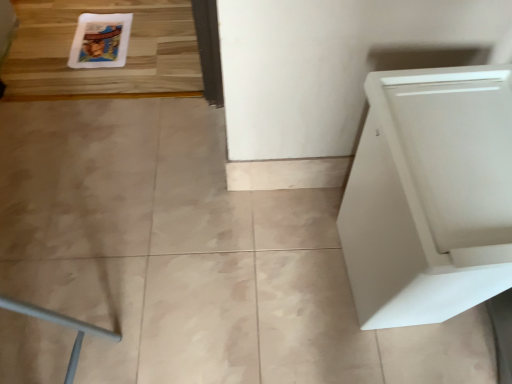
The width and height of the screenshot is (512, 384). What are the coordinates of `vacant region to the left of white matte cabinet at right` in the screenshot? It's located at (278, 273).